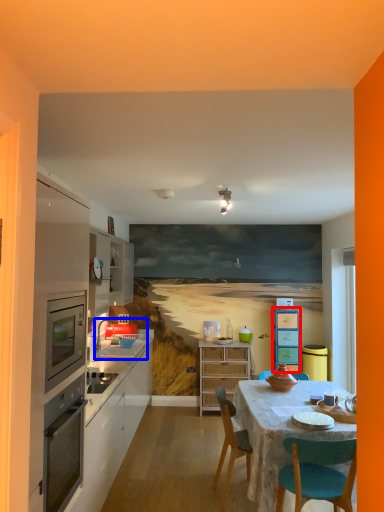
Question: Which point is closer to the camera, cabinetry (highlighted by a red box) or sink (highlighted by a blue box)?

Choices:
 (A) cabinetry
 (B) sink

Answer: (B)